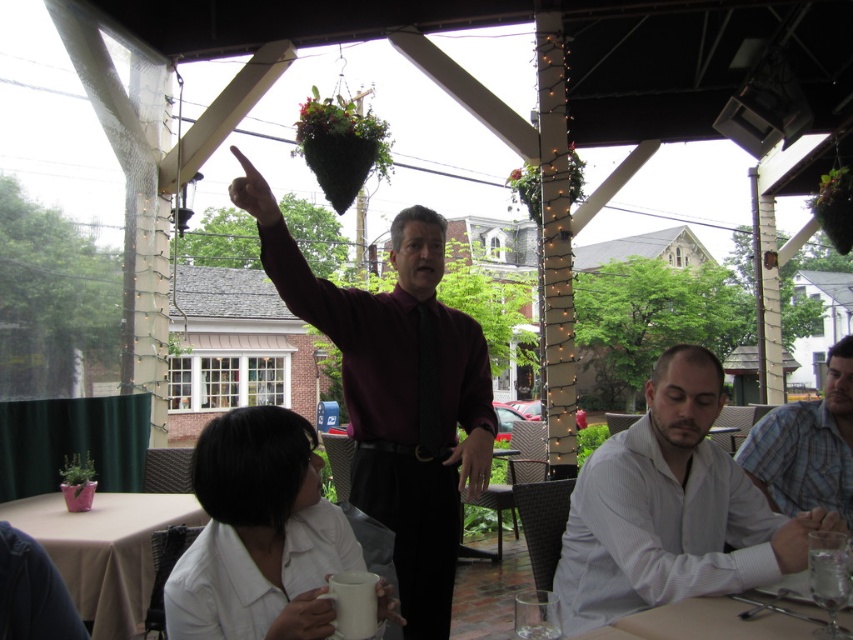
Is matte burgundy shirt at center to the left of plaid shirt at right from the viewer's perspective?

Correct, you'll find matte burgundy shirt at center to the left of plaid shirt at right.

Can you confirm if matte burgundy shirt at center is wider than plaid shirt at right?

Yes, matte burgundy shirt at center is wider than plaid shirt at right.

Where is `matte burgundy shirt at center`? The height and width of the screenshot is (640, 853). matte burgundy shirt at center is located at coordinates (397, 392).

Is matte burgundy shirt at center to the right of white textured shirt at lower right from the viewer's perspective?

No, matte burgundy shirt at center is not to the right of white textured shirt at lower right.

Is matte burgundy shirt at center positioned before white textured shirt at lower right?

That is False.

Measure the distance between matte burgundy shirt at center and camera.

matte burgundy shirt at center is 1.61 meters away from camera.

Locate an element on the screen. The height and width of the screenshot is (640, 853). matte burgundy shirt at center is located at coordinates (397, 392).

Is beige fabric table at lower left in front of plaid shirt at right?

No.

Is beige fabric table at lower left shorter than plaid shirt at right?

Indeed, beige fabric table at lower left has a lesser height compared to plaid shirt at right.

The image size is (853, 640). I want to click on beige fabric table at lower left, so click(103, 548).

At what (x,y) coordinates should I click in order to perform the action: click on beige fabric table at lower left. Please return your answer as a coordinate pair (x, y). The height and width of the screenshot is (640, 853). Looking at the image, I should click on (103, 548).